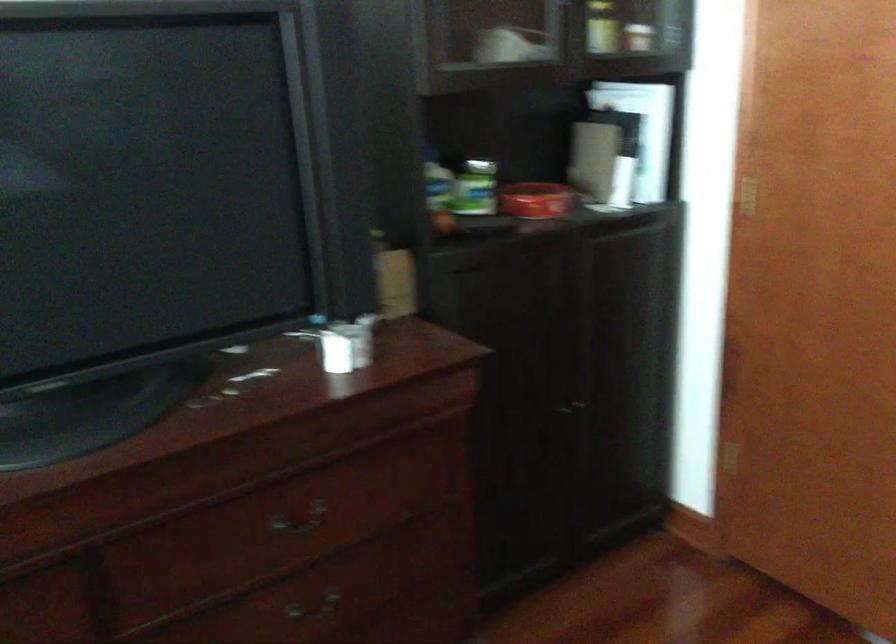
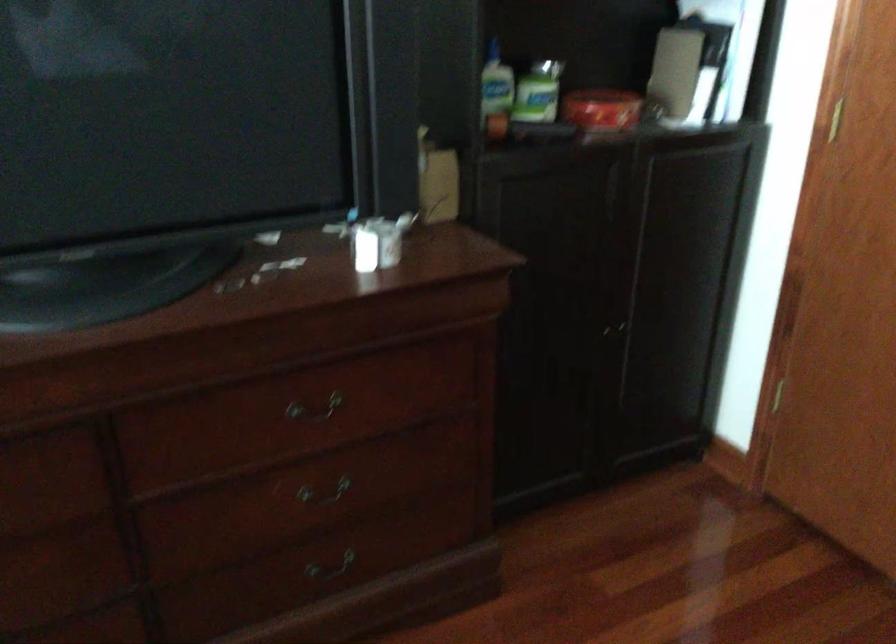
Where in the second image is the point corresponding to [536,202] from the first image?

(600, 109)